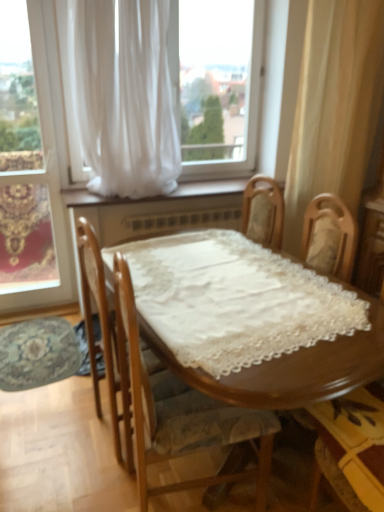
Question: From a real-world perspective, relative to white sheer curtain at left, positioned as the second window in right-to-left order, is wooden chair at lower right, the 2th chair positioned from the left, vertically above or below?

Choices:
 (A) above
 (B) below

Answer: (B)

Question: Is point (357, 448) positioned closer to the camera than point (11, 274)?

Choices:
 (A) closer
 (B) farther

Answer: (A)

Question: Which object is positioned farthest from the wooden chair at lower right, arranged as the 1th chair when viewed from the right?

Choices:
 (A) white sheer curtain at left, placed as the first window when sorted from left to right
 (B) white sheer curtain at right, which is the 1th curtain from right to left
 (C) wooden chair with lace cushion at center, which is the 2th chair from right to left
 (D) white sheer curtain at upper center, the 2th curtain positioned from the right
 (E) white sheer curtain at upper center, which is the second window in left-to-right order

Answer: (A)

Question: Estimate the real-world distances between objects in this image. Which object is farther from the white sheer curtain at upper center, which is the second window in left-to-right order?

Choices:
 (A) white sheer curtain at right, which is the 1th curtain from right to left
 (B) white sheer curtain at upper center, the 2th curtain positioned from the right
 (C) white sheer curtain at left, placed as the first window when sorted from left to right
 (D) wooden chair at lower right, arranged as the 1th chair when viewed from the right
 (E) wooden chair with lace cushion at center, which ranks as the first chair in left-to-right order

Answer: (D)